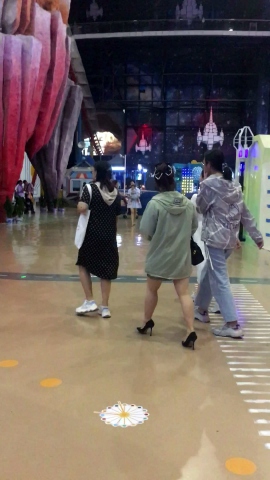
Find the location of a particular element. The height and width of the screenshot is (480, 270). drapes is located at coordinates (42, 112), (75, 105).